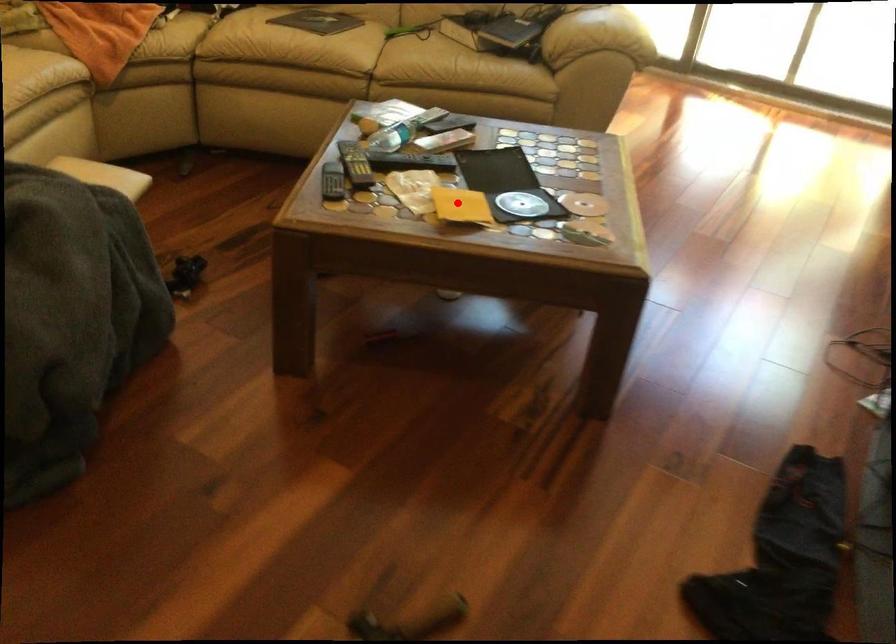
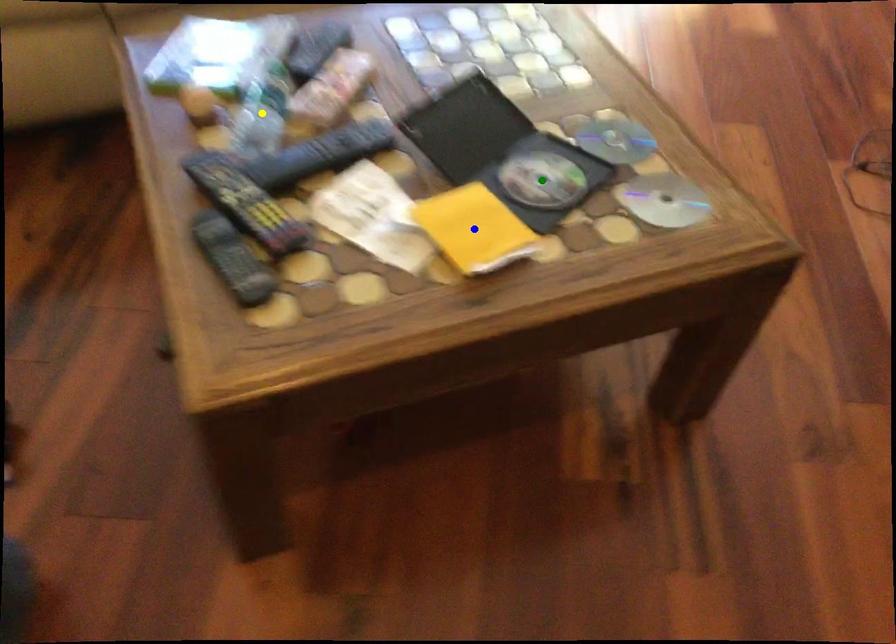
Question: I am providing you with two images of the same scene from different viewpoints. A red point is marked on the first image. You are given multiple points on the second image. Which point in image 2 is actually the same real-world point as the red point in image 1?

Choices:
 (A) yellow point
 (B) green point
 (C) blue point

Answer: (C)